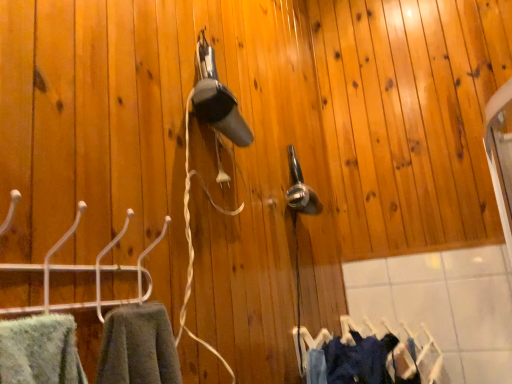
Question: In the image, is denim fabric clothes at lower right positioned in front of or behind dark blue fabric at lower right?

Choices:
 (A) behind
 (B) front

Answer: (A)

Question: Is denim fabric clothes at lower right bigger or smaller than dark blue fabric at lower right?

Choices:
 (A) small
 (B) big

Answer: (B)

Question: Based on their relative distances, which object is nearer to the denim fabric clothes at lower right?

Choices:
 (A) white plastic hanger at left
 (B) dark blue fabric at lower right

Answer: (B)

Question: Which is nearer to the dark blue fabric at lower right?

Choices:
 (A) denim fabric clothes at lower right
 (B) white plastic hanger at left

Answer: (A)